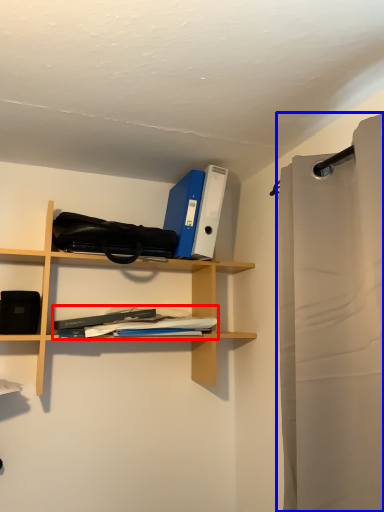
Question: Which point is further to the camera, book (highlighted by a red box) or shower curtain (highlighted by a blue box)?

Choices:
 (A) book
 (B) shower curtain

Answer: (A)